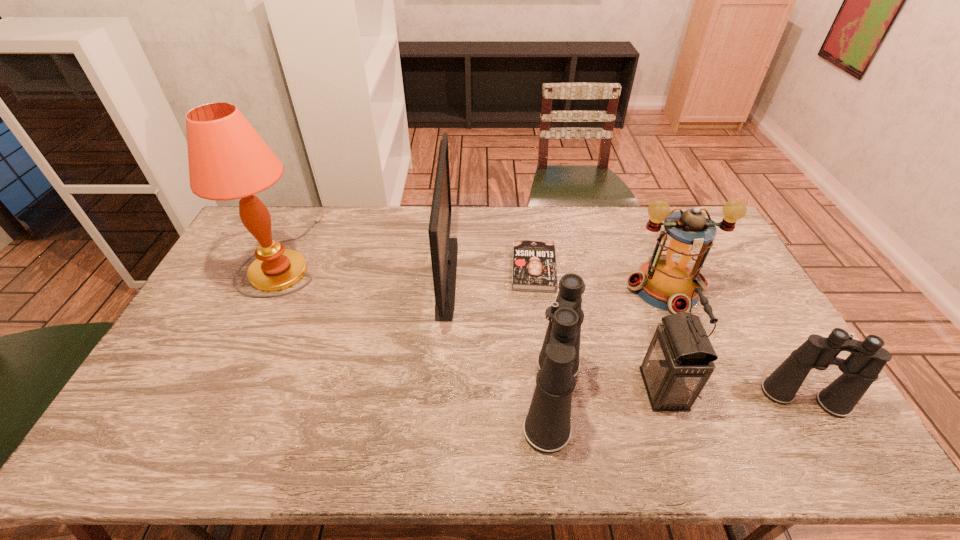
The height and width of the screenshot is (540, 960). In order to click on free spot located on the left of the second shortest object in this screenshot , I will do `click(669, 398)`.

I want to click on vacant space located on the front-facing side of the second object from left to right, so click(537, 276).

This screenshot has height=540, width=960. In order to click on vacant space situated on the front-facing side of the farther lantern in this screenshot , I will do `click(686, 336)`.

Where is `free region located 0.240m on the front of the leftmost object`? free region located 0.240m on the front of the leftmost object is located at coordinates tap(234, 361).

Where is `free spot located on the right of the shortest object`? free spot located on the right of the shortest object is located at coordinates (574, 268).

Where is `vacant space located 0.220m on the front-facing side of the nearer lantern`? The height and width of the screenshot is (540, 960). vacant space located 0.220m on the front-facing side of the nearer lantern is located at coordinates click(x=559, y=389).

Find the location of a particular element. This screenshot has height=540, width=960. vacant space situated 0.060m on the front-facing side of the nearer lantern is located at coordinates (619, 389).

This screenshot has height=540, width=960. Find the location of `vacant space situated 0.190m on the front-facing side of the nearer lantern`. vacant space situated 0.190m on the front-facing side of the nearer lantern is located at coordinates (570, 389).

Locate an element on the screen. The image size is (960, 540). monitor located at the far edge is located at coordinates (444, 250).

Find the location of a particular element. The width and height of the screenshot is (960, 540). lamp that is at the far edge is located at coordinates (228, 160).